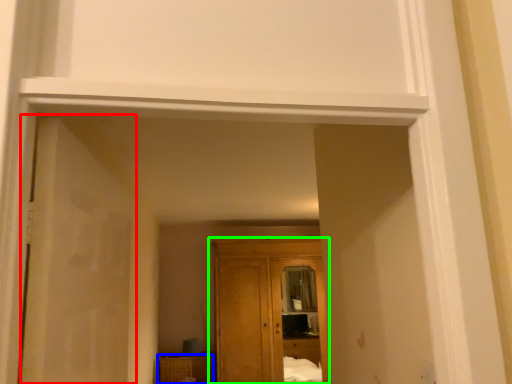
Question: Which object is positioned closest to door (highlighted by a red box)? Select from cabinetry (highlighted by a blue box) and cupboard (highlighted by a green box).

Choices:
 (A) cabinetry
 (B) cupboard

Answer: (B)